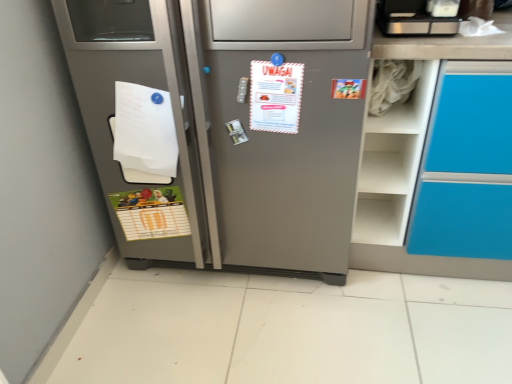
Question: Relative to white matte shelf at upper right, is green matte postcard at lower left, which appears as the second postcard when viewed from the front, in front or behind?

Choices:
 (A) front
 (B) behind

Answer: (B)

Question: Is green matte postcard at lower left, placed as the 1th postcard when sorted from left to right, inside the boundaries of white matte shelf at upper right, or outside?

Choices:
 (A) outside
 (B) inside

Answer: (A)

Question: Considering the real-world distances, which object is closest to the white paper at left?

Choices:
 (A) green matte postcard at lower left, which is the 2th postcard from right to left
 (B) white matte shelf at upper right
 (C) brushed metal toaster at upper right
 (D) satin silver refrigerator at center
 (E) white paper at center, which is the first postcard in top-to-bottom order

Answer: (A)

Question: Which is nearer to the brushed metal toaster at upper right?

Choices:
 (A) white paper at left
 (B) green matte postcard at lower left, which appears as the second postcard when viewed from the front
 (C) white paper at center, which is the 2th postcard in back-to-front order
 (D) white matte shelf at upper right
 (E) satin silver refrigerator at center

Answer: (D)